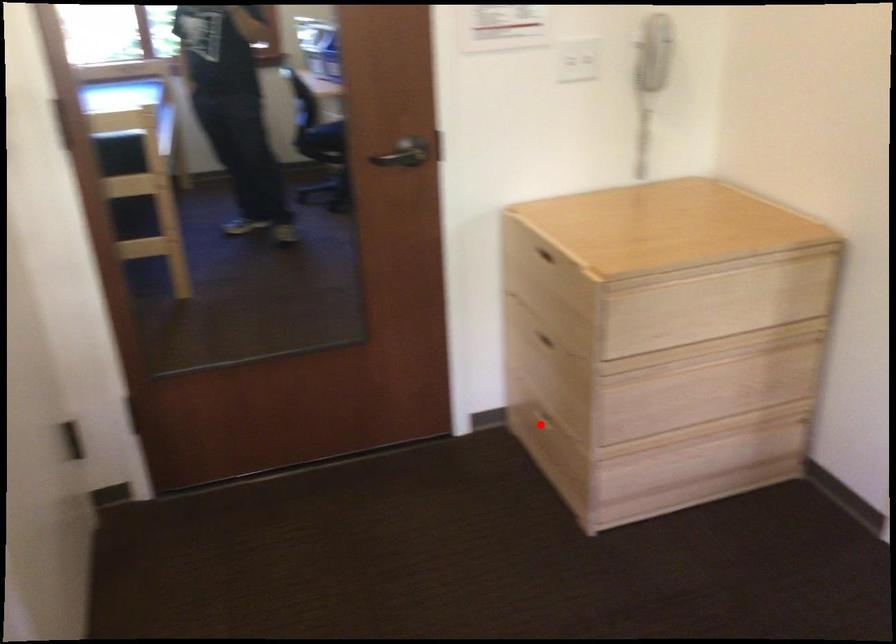
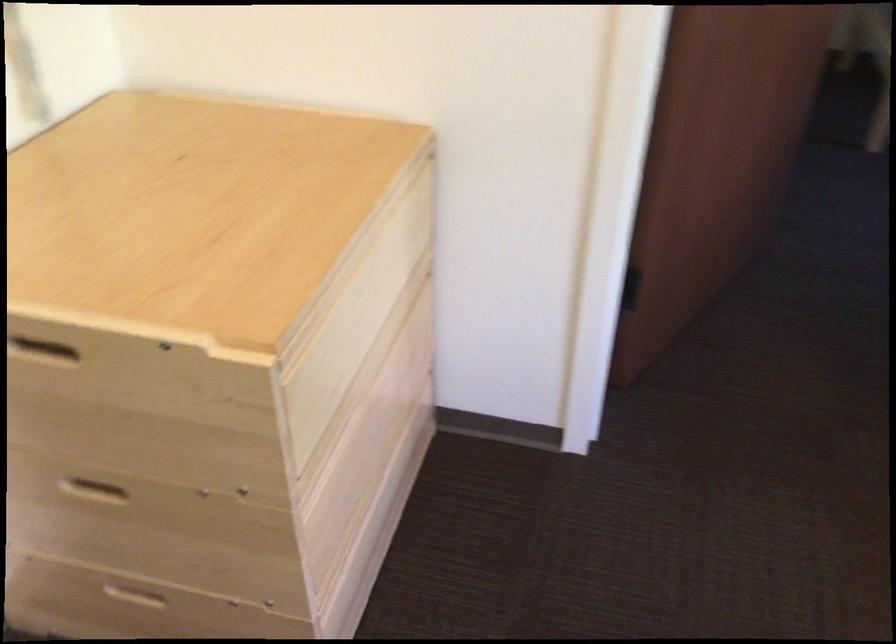
Question: I am providing you with two images of the same scene from different viewpoints. A red point is marked on the first image. Can you still see the location of the red point in image 2?

Choices:
 (A) Yes
 (B) No

Answer: (A)